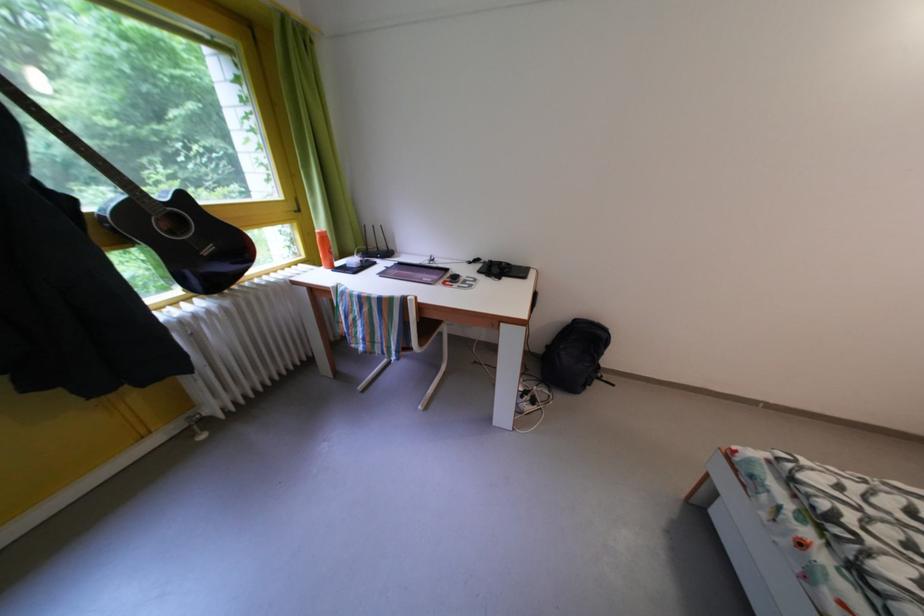
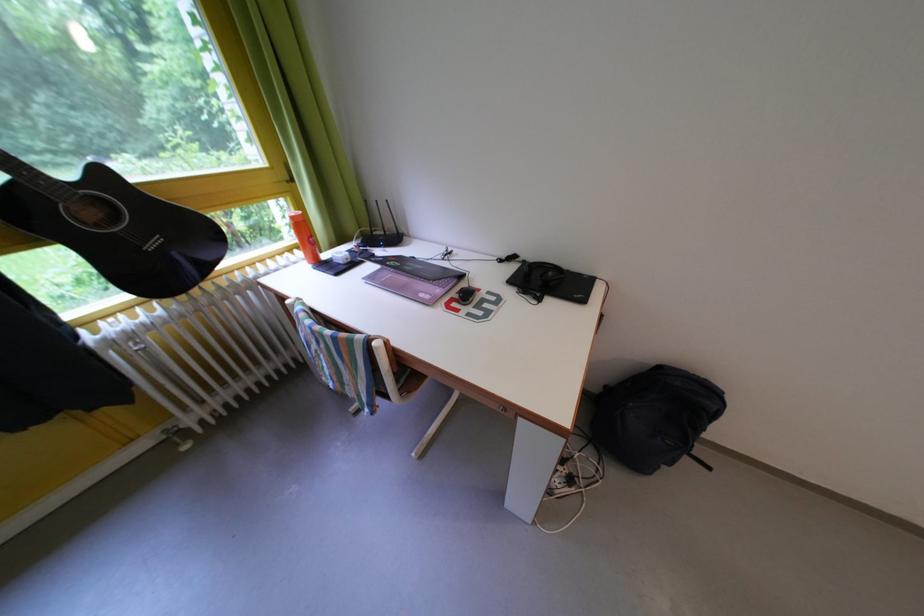
Locate, in the second image, the point that corresponds to (494,268) in the first image.

(533, 267)